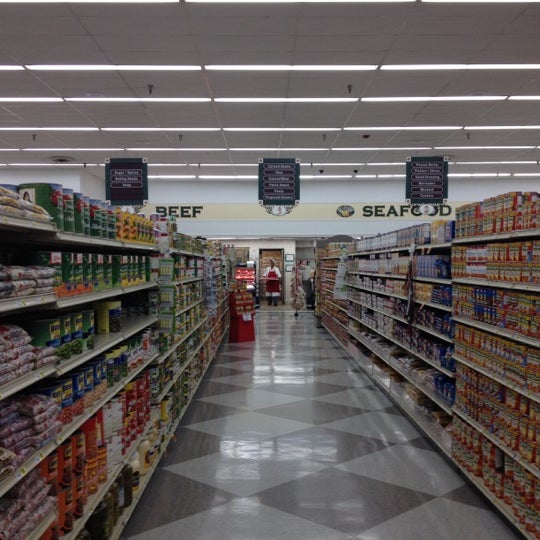
This screenshot has width=540, height=540. In order to click on doorway in this screenshot , I will do `click(278, 253)`.